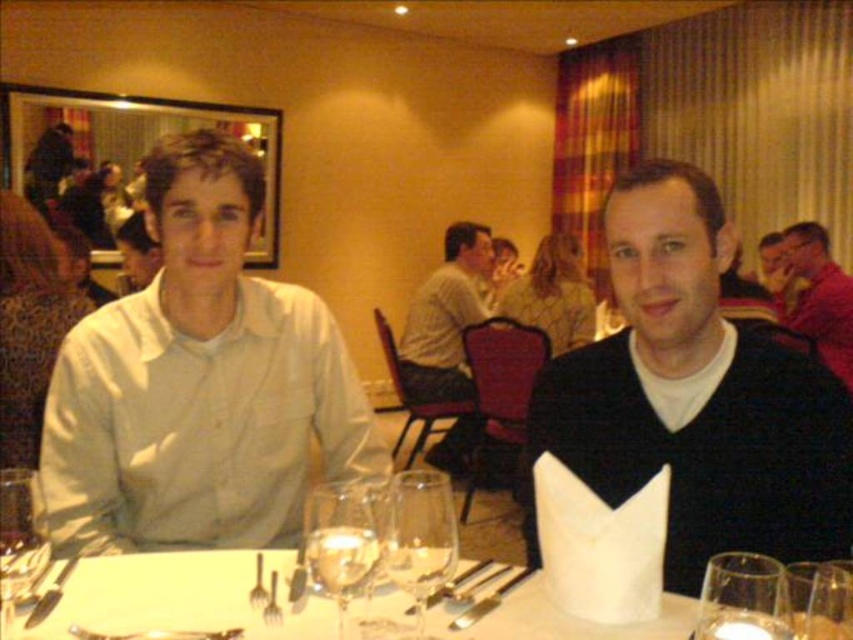
Which is more to the right, transparent glass at center or matte black shirt at upper right?

matte black shirt at upper right

Does transparent glass at center have a smaller size compared to matte black shirt at upper right?

Yes.

Who is more distant from viewer, (x=772, y=604) or (x=793, y=296)?

Point (x=793, y=296)

Where is `transparent glass at center`? The height and width of the screenshot is (640, 853). transparent glass at center is located at coordinates (741, 598).

Between light gray shirt at center and shiny silver fork at center, which one is positioned lower?

shiny silver fork at center is below.

Which is more to the left, light gray shirt at center or shiny silver fork at center?

From the viewer's perspective, shiny silver fork at center appears more on the left side.

Identify the location of light gray shirt at center. (445, 317).

Is transparent glass wine glass at center positioned before transparent glass at center?

No, transparent glass wine glass at center is further to the viewer.

Is point (422, 596) positioned behind point (756, 561)?

Yes, it is behind point (756, 561).

Which is in front, point (430, 588) or point (735, 564)?

Point (735, 564)

I want to click on transparent glass wine glass at center, so click(421, 536).